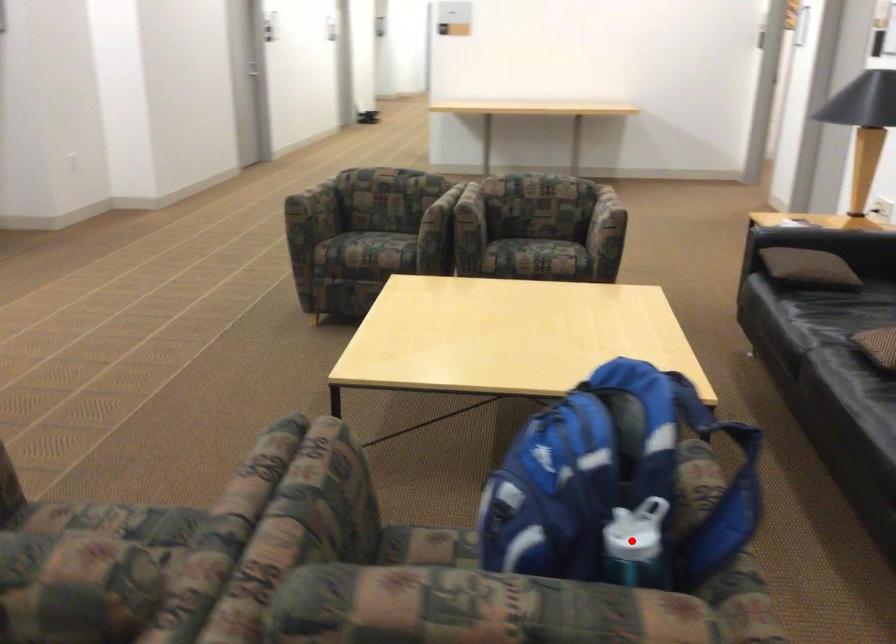
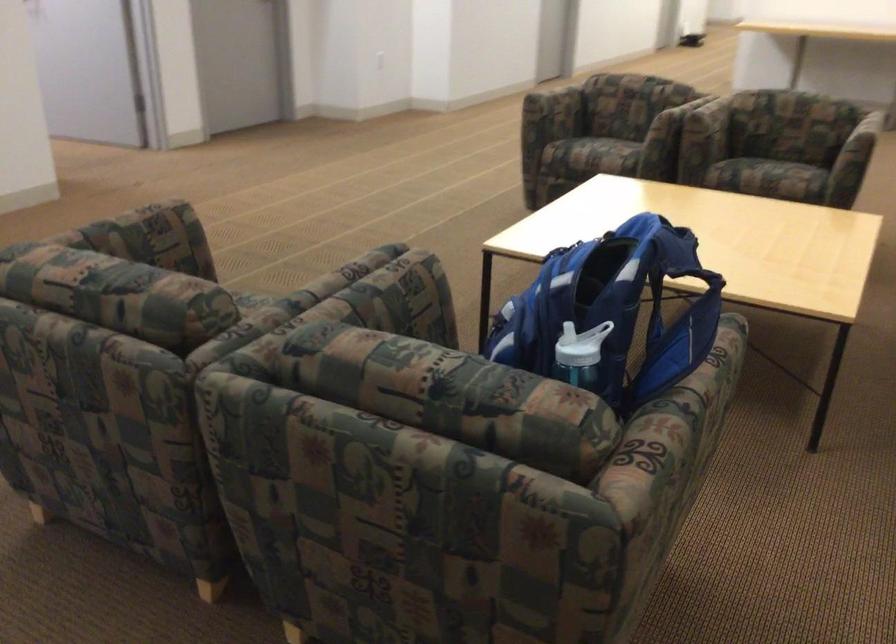
Find the pixel in the second image that matches the highlighted location in the first image.

(574, 348)